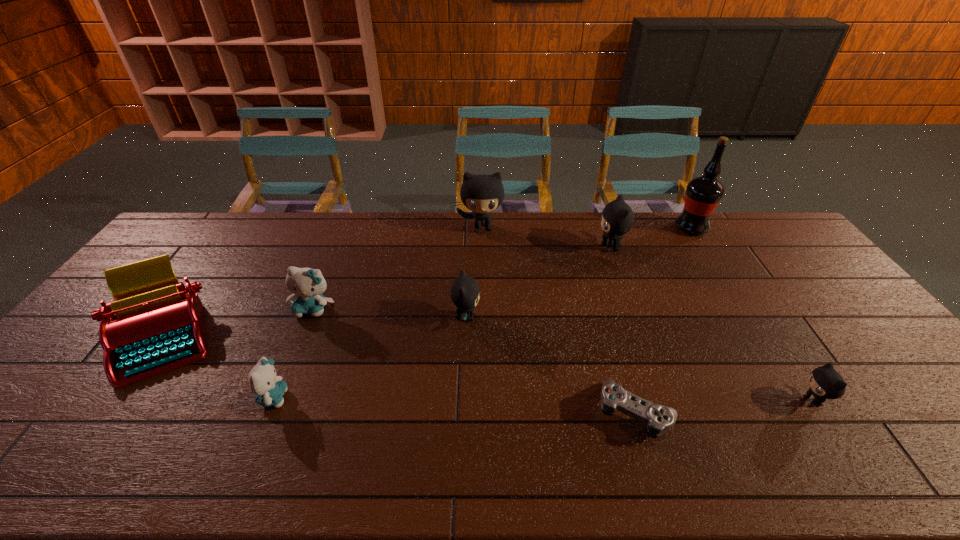
Identify the location of vacant area at the far edge of the desktop. (474, 219).

This screenshot has height=540, width=960. Identify the location of free region at the near edge of the desktop. (745, 454).

What are the coordinates of `free space at the left edge` in the screenshot? It's located at (62, 428).

What are the coordinates of `vacant space at the right edge of the desktop` in the screenshot? It's located at [882, 344].

In the image, there is a desktop. Find the location of `vacant space at the far right corner`. vacant space at the far right corner is located at coordinates (769, 234).

Locate an element on the screen. free area in between the white control and the eighth shortest object is located at coordinates (559, 320).

I want to click on free space between the third gray kitten from left to right and the third biggest gray kitten, so click(539, 282).

Image resolution: width=960 pixels, height=540 pixels. Find the location of `free point between the nearer blue kitten and the biggest gray kitten`. free point between the nearer blue kitten and the biggest gray kitten is located at coordinates (377, 313).

Identify the location of vacant region between the nearer blue kitten and the second nearest gray kitten. (370, 357).

Identify the location of vacant space that is in between the tallest object and the typewriter. (427, 282).